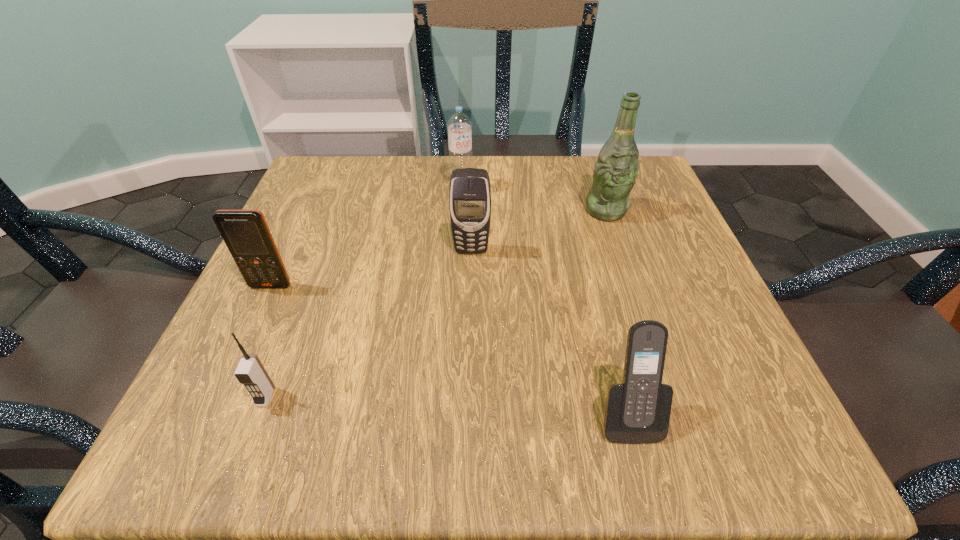
Where is `object present at the far right corner`? The height and width of the screenshot is (540, 960). object present at the far right corner is located at coordinates (615, 172).

Where is `object located at the near right corner`? object located at the near right corner is located at coordinates (637, 411).

What are the coordinates of `free space at the far edge of the desktop` in the screenshot? It's located at (407, 183).

In the image, there is a desktop. At what (x,y) coordinates should I click in order to perform the action: click on vacant space at the near edge. Please return your answer as a coordinate pair (x, y). Looking at the image, I should click on (591, 449).

In the image, there is a desktop. Where is `free space at the left edge`? free space at the left edge is located at coordinates (285, 251).

You are a GUI agent. You are given a task and a screenshot of the screen. Output one action in this format:
    pyautogui.click(x=<x>, y=<y>)
    Task: Click on the free space at the right edge of the desktop
    The image size is (960, 540).
    Given the screenshot: What is the action you would take?
    pyautogui.click(x=687, y=247)

In the image, there is a desktop. Where is `vacant region at the far left corner`? vacant region at the far left corner is located at coordinates (370, 208).

Where is `free region at the near left corner of the desktop`? free region at the near left corner of the desktop is located at coordinates (290, 451).

In the image, there is a desktop. Identify the location of vacant region at the far right corner. The image size is (960, 540). (649, 198).

This screenshot has height=540, width=960. In order to click on free space between the leftmost cellular telephone and the shortest object in this screenshot , I will do `click(268, 341)`.